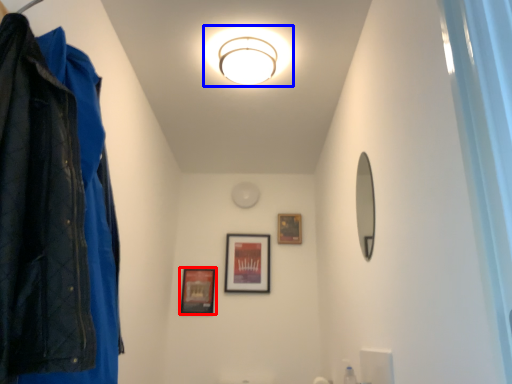
Question: Which point is closer to the camera, picture frame (highlighted by a red box) or light fixture (highlighted by a blue box)?

Choices:
 (A) picture frame
 (B) light fixture

Answer: (B)